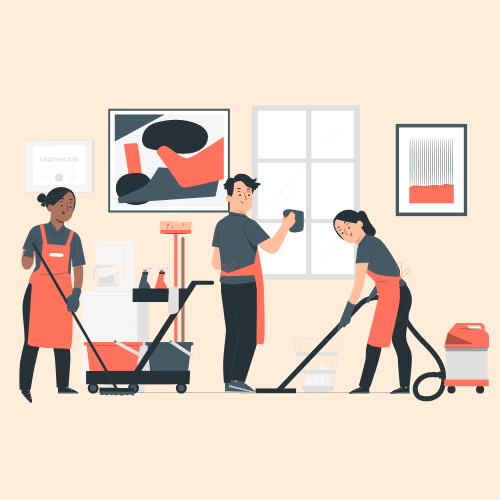
Image resolution: width=500 pixels, height=500 pixels. Find the location of `picture frames`. picture frames is located at coordinates (208, 129), (428, 188).